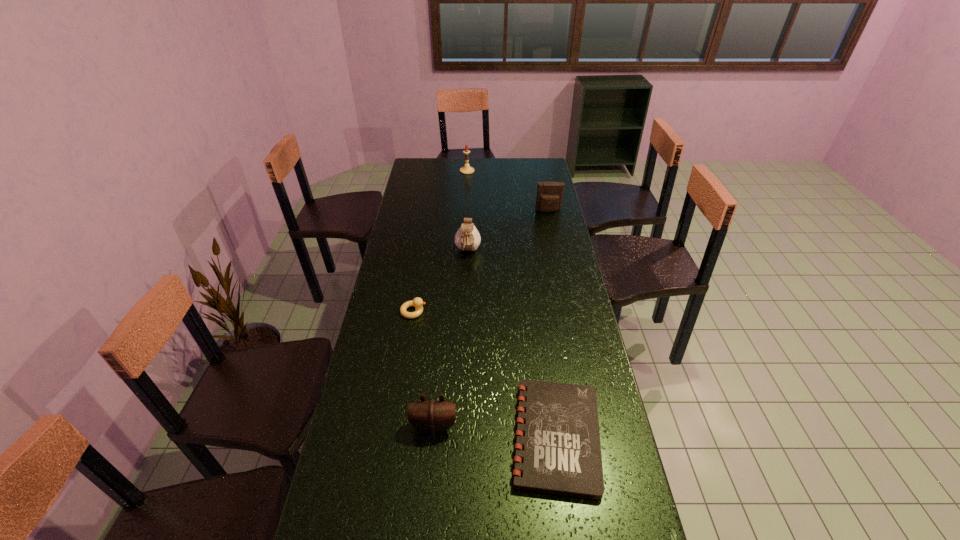
At what (x,y) coordinates should I click in order to perform the action: click on candle. Please return your answer as a coordinate pair (x, y). Image resolution: width=960 pixels, height=540 pixels. Looking at the image, I should click on (466, 169).

Locate an element on the screen. This screenshot has height=540, width=960. the farthest pouch is located at coordinates pyautogui.click(x=549, y=197).

Where is `the rightmost pouch`? This screenshot has height=540, width=960. the rightmost pouch is located at coordinates (549, 197).

This screenshot has height=540, width=960. I want to click on the third farthest object, so pos(467,238).

Where is `the shortest pouch`? the shortest pouch is located at coordinates (432, 416).

I want to click on the nearest pouch, so click(432, 416).

This screenshot has width=960, height=540. Identify the location of the second shortest object. (417, 302).

Identify the location of duckling. (417, 302).

Image resolution: width=960 pixels, height=540 pixels. Identify the location of notebook. (562, 455).

The image size is (960, 540). In order to click on vacant space positioned on the back of the candle in this screenshot , I will do `click(468, 159)`.